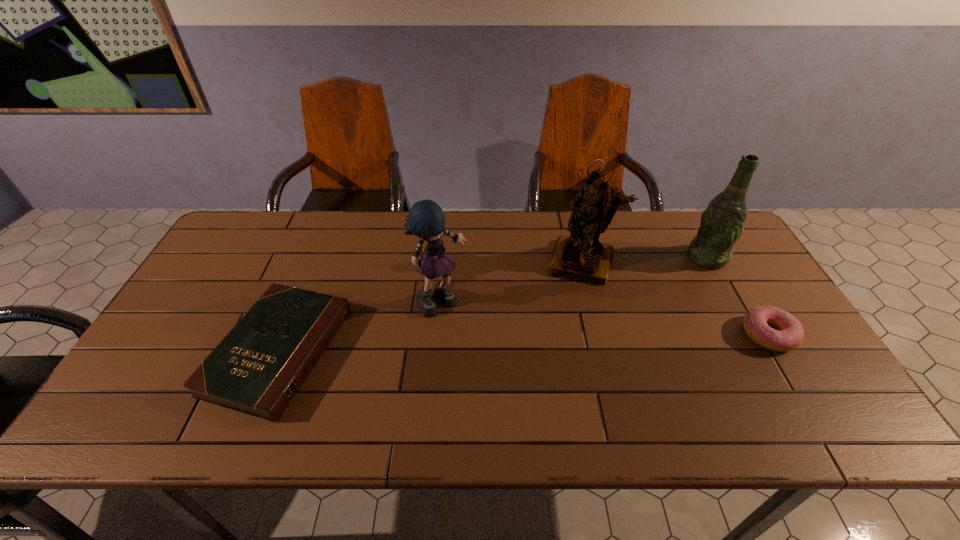
You are a GUI agent. You are given a task and a screenshot of the screen. Output one action in this format:
    pyautogui.click(x=<x>, y=<y>)
    Task: Click on the vacant region that satisfies the following two spatial constraints: 1. on the front side of the third object from left to right; 2. on the left side of the doughnut
    Image resolution: width=960 pixels, height=540 pixels.
    Given the screenshot: What is the action you would take?
    pyautogui.click(x=599, y=335)

Locate an element on the screen. The image size is (960, 540). blank area in the image that satisfies the following two spatial constraints: 1. on the back side of the beer bottle; 2. on the left side of the second object from left to right is located at coordinates (445, 258).

The width and height of the screenshot is (960, 540). What are the coordinates of `free space that satisfies the following two spatial constraints: 1. on the back side of the beer bottle; 2. on the right side of the second object from left to right` in the screenshot? It's located at (445, 258).